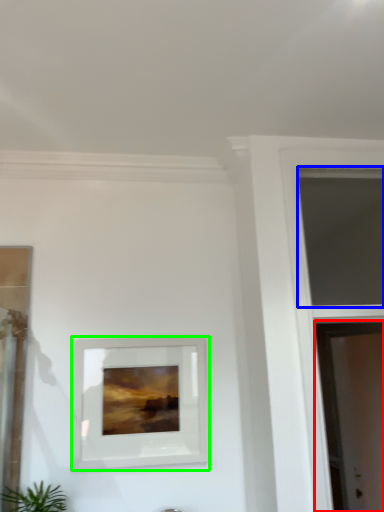
Question: Based on their relative distances, which object is nearer to screen door (highlighted by a red box)? Choose from window (highlighted by a blue box) and picture frame (highlighted by a green box).

Choices:
 (A) window
 (B) picture frame

Answer: (A)